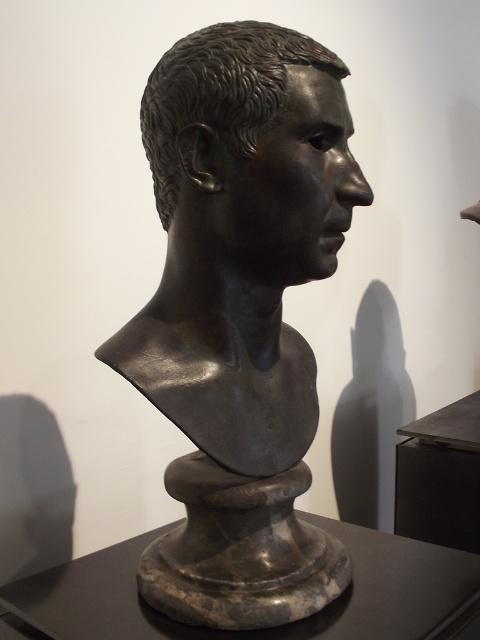
Which is above, bronze bust at center or bronze head at center?

bronze head at center

Between bronze bust at center and bronze head at center, which one has more height?

bronze bust at center is taller.

Between point (202, 109) and point (360, 202), which one is positioned in front?

Positioned in front is point (202, 109).

Locate an element on the screen. The image size is (480, 640). bronze bust at center is located at coordinates (240, 316).